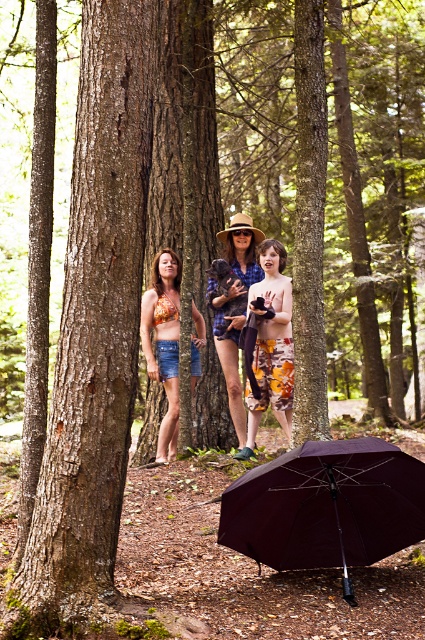
This screenshot has width=425, height=640. Describe the element at coordinates (326, 506) in the screenshot. I see `burgundy fabric umbrella at lower center` at that location.

Which of these two, burgundy fabric umbrella at lower center or matte blue shirt at center, stands shorter?

burgundy fabric umbrella at lower center

Is point (291, 520) closer to camera compared to point (240, 324)?

Yes, it is.

This screenshot has width=425, height=640. Find the location of `burgundy fabric umbrella at lower center`. burgundy fabric umbrella at lower center is located at coordinates (326, 506).

Between point (289, 301) and point (235, 216), which one is positioned in front?

Point (289, 301) is in front.

The height and width of the screenshot is (640, 425). In order to click on floral-patterned leggings at center in this screenshot , I will do `click(271, 342)`.

Is point (272, 285) positioned behind point (232, 419)?

No.

You are a GUI agent. You are given a task and a screenshot of the screen. Output one action in this format:
    pyautogui.click(x=<x>, y=<y>)
    Task: Click on the floral-patterned leggings at center
    Image resolution: width=425 pixels, height=640 pixels.
    Given the screenshot: What is the action you would take?
    pyautogui.click(x=271, y=342)

Does floral-patterned leggings at center have a greater height compared to floral fabric bikini top at center?

Incorrect, floral-patterned leggings at center's height is not larger of floral fabric bikini top at center's.

Is floral-patterned leggings at center positioned in front of floral fabric bikini top at center?

Yes, it is.

Which is behind, point (289, 342) or point (139, 324)?

The point (289, 342) is behind.

The width and height of the screenshot is (425, 640). What are the coordinates of `floral-patterned leggings at center` in the screenshot? It's located at (271, 342).